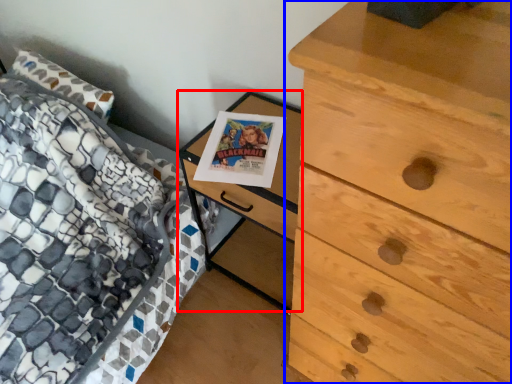
Question: Which of the following is the closest to the observer, nightstand (highlighted by a red box) or chest of drawers (highlighted by a blue box)?

Choices:
 (A) nightstand
 (B) chest of drawers

Answer: (B)